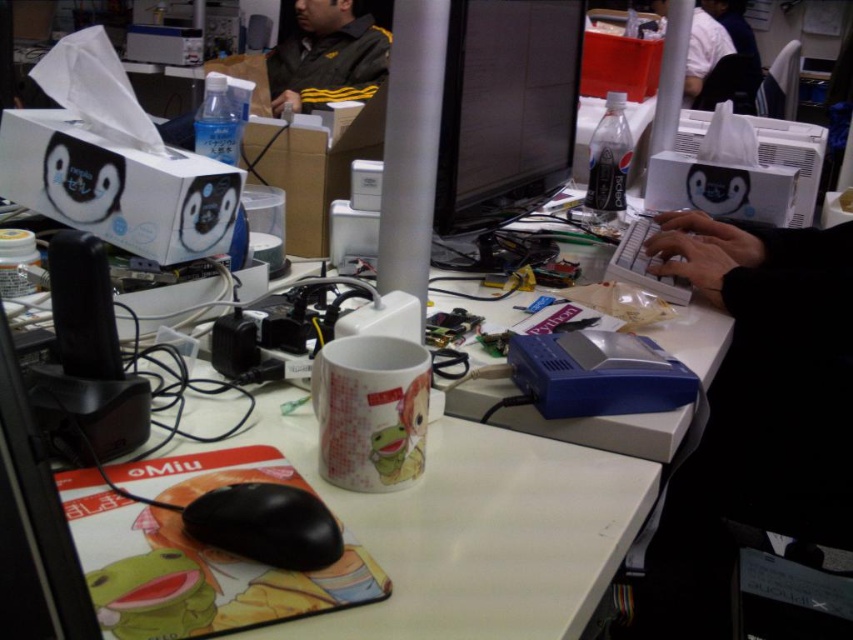
Question: Which is farther from the black plastic mouse at lower left?

Choices:
 (A) dark green jacket at upper center
 (B) matte black monitor at center

Answer: (A)

Question: Among these objects, which one is farthest from the camera?

Choices:
 (A) dark green jacket at upper center
 (B) black plastic mouse at lower left
 (C) matte black monitor at center

Answer: (A)

Question: Can you confirm if dark green jacket at upper center is positioned to the right of black plastic mouse at lower left?

Choices:
 (A) no
 (B) yes

Answer: (A)

Question: Which object is closer to the camera taking this photo?

Choices:
 (A) matte black monitor at center
 (B) black plastic mouse at lower left
 (C) dark green jacket at upper center

Answer: (B)

Question: Is dark green jacket at upper center behind black plastic mouse at lower left?

Choices:
 (A) no
 (B) yes

Answer: (B)

Question: Is dark green jacket at upper center to the right of black plastic mouse at lower left from the viewer's perspective?

Choices:
 (A) no
 (B) yes

Answer: (A)